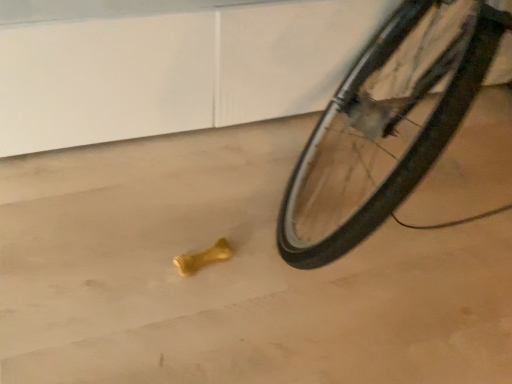
Where is `vacant space underneath black rubber bicycle wheel at lower right (from a real-world perspective)`? The height and width of the screenshot is (384, 512). vacant space underneath black rubber bicycle wheel at lower right (from a real-world perspective) is located at coordinates (422, 180).